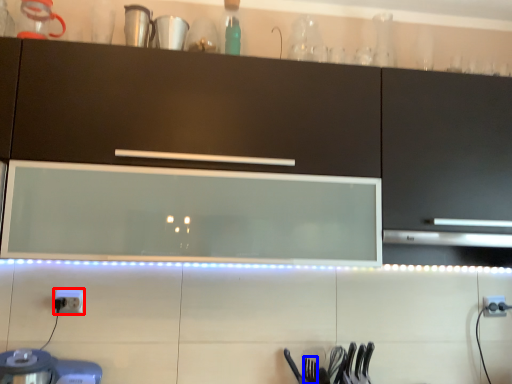
Question: Which point is closer to the camera, electric outlet (highlighted by a red box) or silverware (highlighted by a blue box)?

Choices:
 (A) electric outlet
 (B) silverware

Answer: (B)